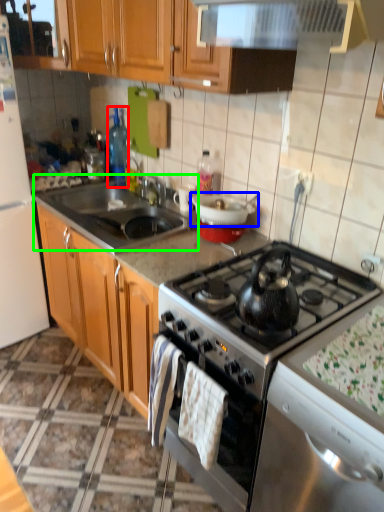
Question: Based on their relative distances, which object is nearer to bottle (highlighted by a red box)? Choose from kitchen appliance (highlighted by a blue box) and sink (highlighted by a green box).

Choices:
 (A) kitchen appliance
 (B) sink

Answer: (B)